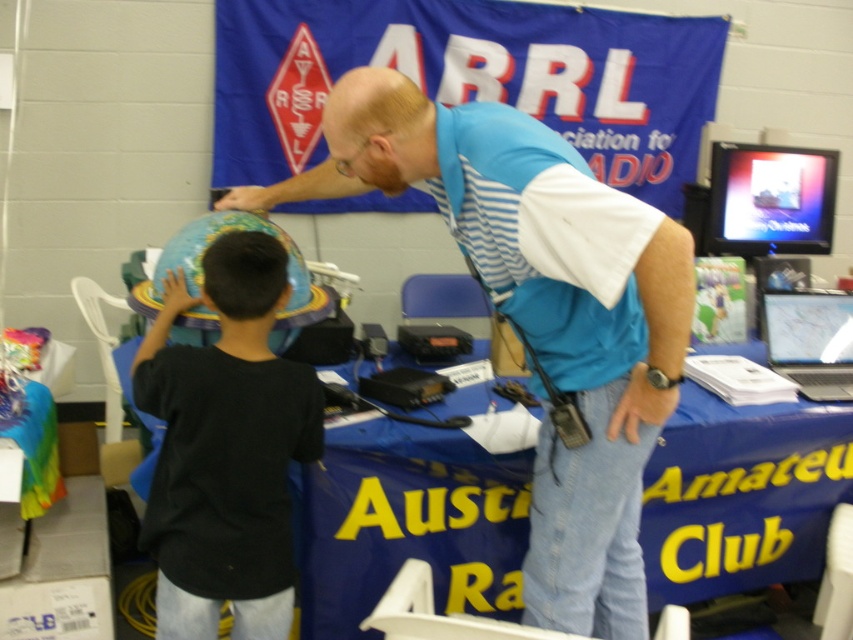
Based on the photo, can you confirm if black matte hair at upper left is bigger than bald scalp at upper center?

Correct, black matte hair at upper left is larger in size than bald scalp at upper center.

Can you confirm if black matte hair at upper left is positioned above bald scalp at upper center?

Incorrect, black matte hair at upper left is not positioned above bald scalp at upper center.

Is point (247, 310) in front of point (386, 104)?

That is False.

Identify the location of black matte hair at upper left. 244,275.

Does black matte globe at left have a lesser width compared to black matte hair at upper left?

No.

Does black matte globe at left appear under black matte hair at upper left?

Yes, black matte globe at left is below black matte hair at upper left.

Image resolution: width=853 pixels, height=640 pixels. What do you see at coordinates (225, 448) in the screenshot?
I see `black matte globe at left` at bounding box center [225, 448].

Locate an element on the screen. The image size is (853, 640). black matte globe at left is located at coordinates (225, 448).

Does blue striped shirt at upper center have a lesser width compared to bald scalp at upper center?

No.

The image size is (853, 640). What do you see at coordinates (544, 321) in the screenshot?
I see `blue striped shirt at upper center` at bounding box center [544, 321].

This screenshot has height=640, width=853. What are the coordinates of `blue striped shirt at upper center` in the screenshot? It's located at (544, 321).